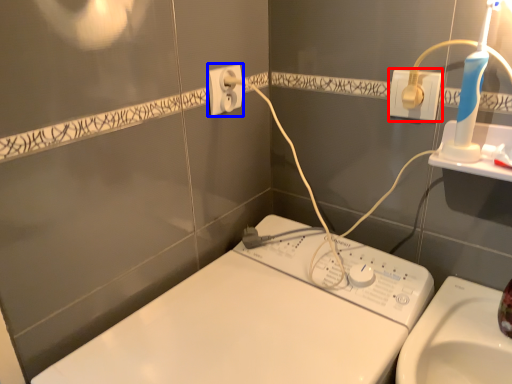
Question: Which point is closer to the camera, power plugs and sockets (highlighted by a red box) or power plugs and sockets (highlighted by a blue box)?

Choices:
 (A) power plugs and sockets
 (B) power plugs and sockets

Answer: (A)